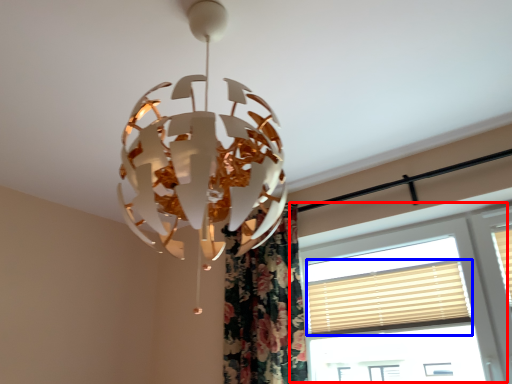
Question: Which object is further to the camera taking this photo, window (highlighted by a red box) or blind (highlighted by a blue box)?

Choices:
 (A) window
 (B) blind

Answer: (B)